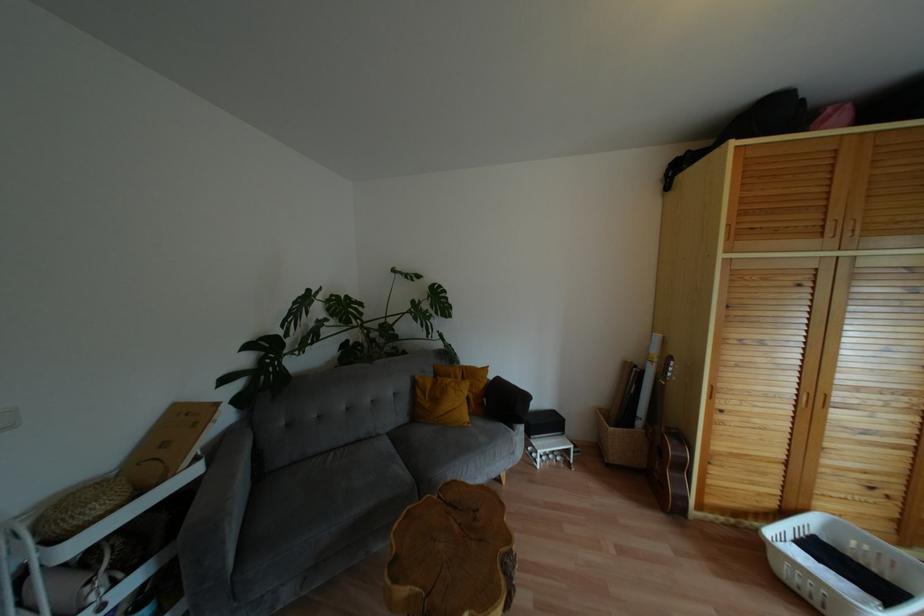
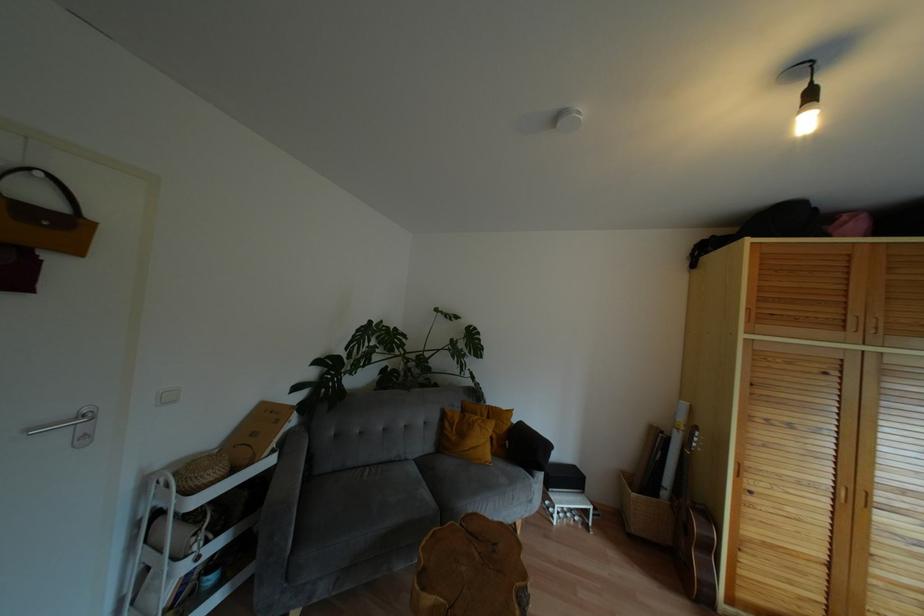
The point at (682, 467) is marked in the first image. Where is the corresponding point in the second image?

(710, 548)